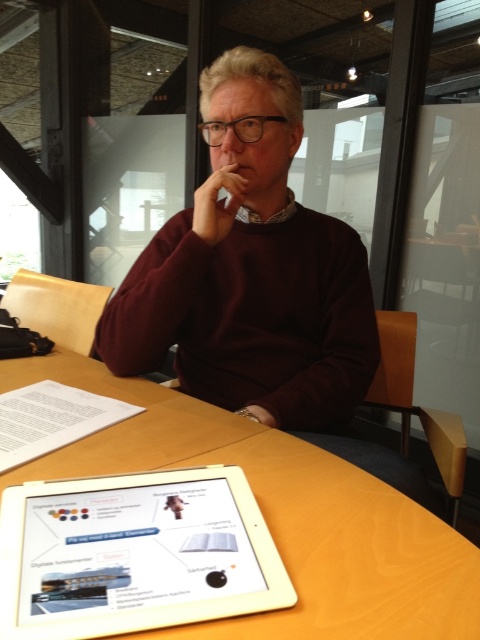
Between maroon sweater at center and white glossy tablet at center, which one is positioned lower?

Positioned lower is white glossy tablet at center.

Does maroon sweater at center lie in front of white glossy tablet at center?

No, it is not.

This screenshot has height=640, width=480. Find the location of `maroon sweater at center`. maroon sweater at center is located at coordinates (251, 272).

Identify the location of maroon sweater at center. This screenshot has width=480, height=640. (251, 272).

In the scene shown: Who is more distant from viewer, (259, 403) or (388, 637)?

Point (259, 403)

Is point (242, 221) in front of point (279, 506)?

No, it is not.

Where is `maroon sweater at center`? Image resolution: width=480 pixels, height=640 pixels. maroon sweater at center is located at coordinates (251, 272).

Measure the distance between wooden table at center and white glossy tablet at center.

wooden table at center is 6.51 inches from white glossy tablet at center.

Which is behind, point (477, 630) or point (143, 609)?

Point (477, 630)

Identify the location of wooden table at center. (280, 515).